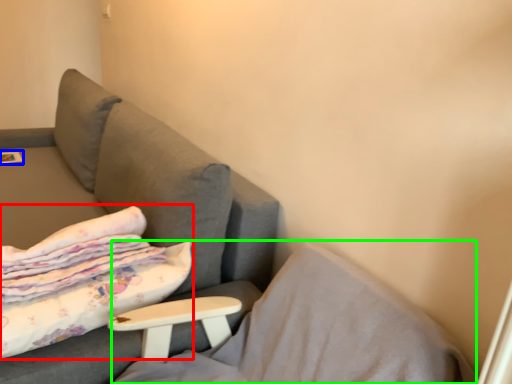
Question: Based on their relative distances, which object is farther from bed (highlighted by a red box)? Choose from magazine (highlighted by a blue box) and pillow (highlighted by a green box).

Choices:
 (A) magazine
 (B) pillow

Answer: (A)